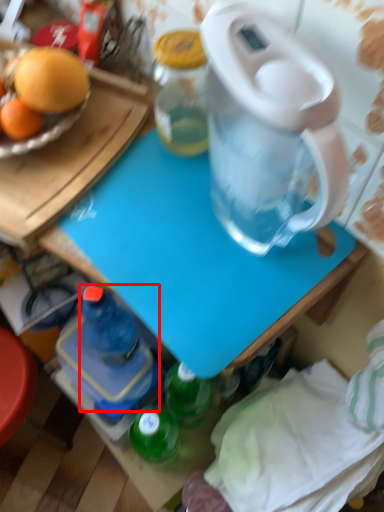
Question: From the image's perspective, what is the correct spatial positioning of bottle (annotated by the red box) in reference to table?

Choices:
 (A) below
 (B) above

Answer: (A)